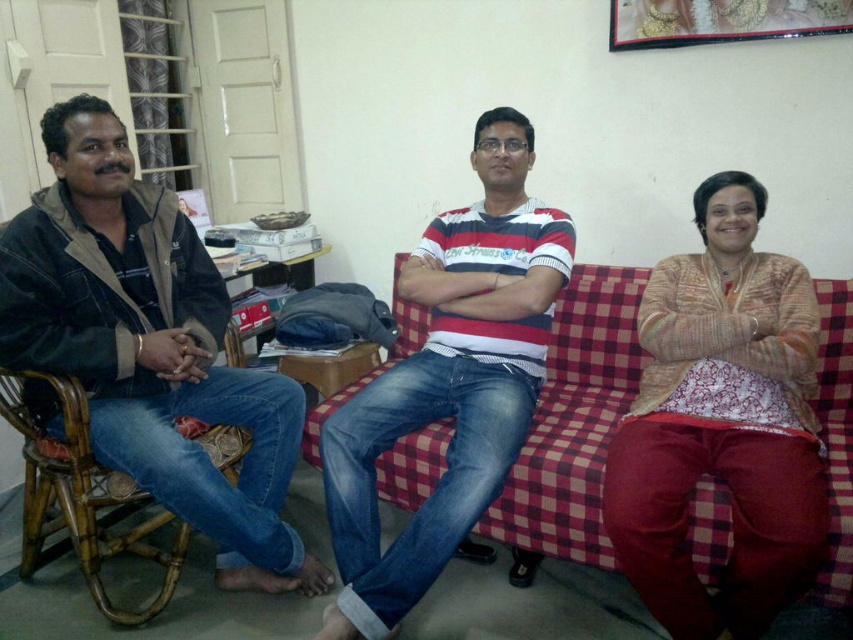
You are standing in the living room and want to sit on the checkered fabric couch at center. Which direction should you move to reach it?

The checkered fabric couch at center is located at point 0.674 on the horizontal axis. Since you are standing in the living room, you should move towards the center of the room to reach the checkered fabric couch at center.

You are a delivery person who needs to place a rectangular package that is 3 feet long on a table between the checkered fabric couch at center and the gold metallic picture frame at upper center. Is there enough space between them to place the package horizontally?

The distance between the checkered fabric couch at center and the gold metallic picture frame at upper center is 3.53 feet. Since the package is 3 feet long, there is sufficient space to place it horizontally between them.

You are a photographer setting up a shoot in the living room. You need to position a large camera tripod between the checkered fabric couch at center and the gold metallic picture frame at upper center. Based on their positions, which object should the tripod be placed closer to?

The checkered fabric couch at center is to the left of the gold metallic picture frame at upper center, so the tripod should be placed closer to the checkered fabric couch at center to maintain balance between the two objects.